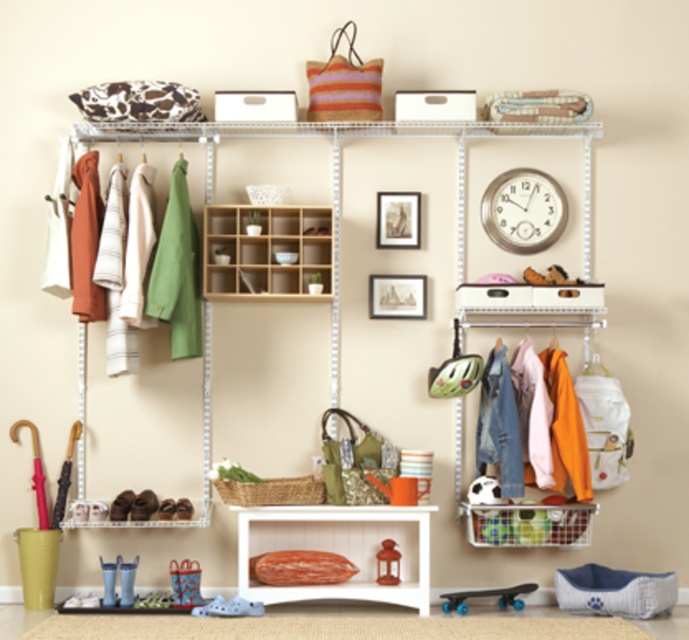
Question: Can you confirm if metal wire shelving at upper center is positioned to the left of white wood shelf at center?

Choices:
 (A) no
 (B) yes

Answer: (B)

Question: Which point is closer to the camera taking this photo?

Choices:
 (A) pos(167,209)
 (B) pos(389,513)
 (C) pos(484,324)

Answer: (B)

Question: Does white wood shelf at center appear on the left side of wooden shelves at center?

Choices:
 (A) no
 (B) yes

Answer: (A)

Question: Can you confirm if white wood shelf at center is thinner than wooden shelves at center?

Choices:
 (A) no
 (B) yes

Answer: (A)

Question: Which object is the closest to the white wood shelf at center?

Choices:
 (A) green matte jacket at left
 (B) wooden shelves at center
 (C) metal wire shelving at upper center
 (D) silver metallic clock at upper center

Answer: (A)

Question: Based on their relative distances, which object is farther from the metal wire shelving at upper center?

Choices:
 (A) blue rubber skateboard at lower center
 (B) green matte jacket at left
 (C) matte red lantern at center

Answer: (A)